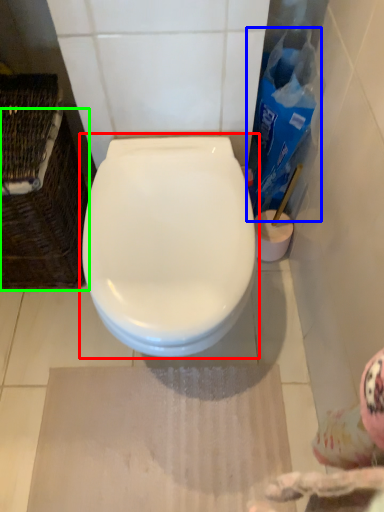
Question: Considering the real-world distances, which object is closest to toilet (highlighted by a red box)? cleaning product (highlighted by a blue box) or basket (highlighted by a green box).

Choices:
 (A) cleaning product
 (B) basket

Answer: (B)